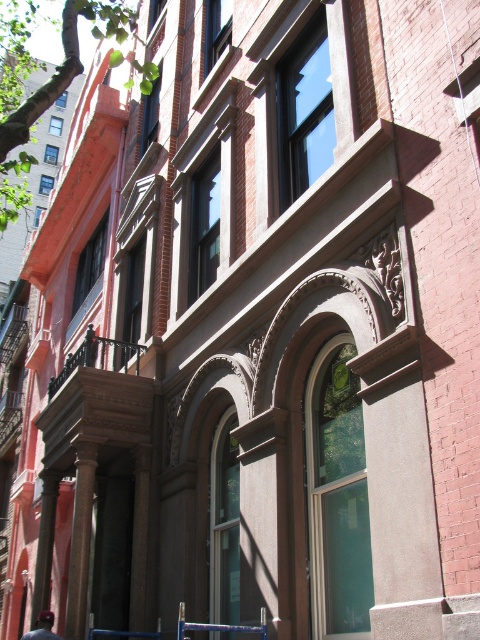
Question: Can you confirm if brown wooden railing at upper left is bigger than dark blue baseball cap at lower left?

Choices:
 (A) yes
 (B) no

Answer: (B)

Question: Is brown wooden railing at upper left to the left of dark blue baseball cap at lower left from the viewer's perspective?

Choices:
 (A) no
 (B) yes

Answer: (A)

Question: Which point is closer to the camera taking this photo?

Choices:
 (A) (95, 349)
 (B) (56, 636)

Answer: (B)

Question: Can you confirm if brown wooden railing at upper left is positioned below dark blue baseball cap at lower left?

Choices:
 (A) yes
 (B) no

Answer: (B)

Question: Which object is farther from the camera taking this photo?

Choices:
 (A) brown wooden railing at upper left
 (B) dark blue baseball cap at lower left

Answer: (A)